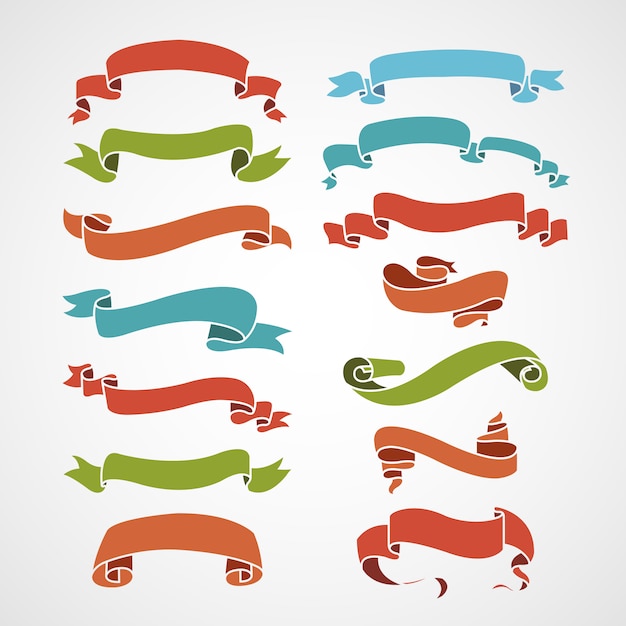
This screenshot has width=626, height=626. I want to click on ribbons on left side, so click(x=190, y=151), click(x=168, y=56), click(x=180, y=232), click(x=178, y=314), click(x=175, y=392), click(x=178, y=473), click(x=168, y=545).